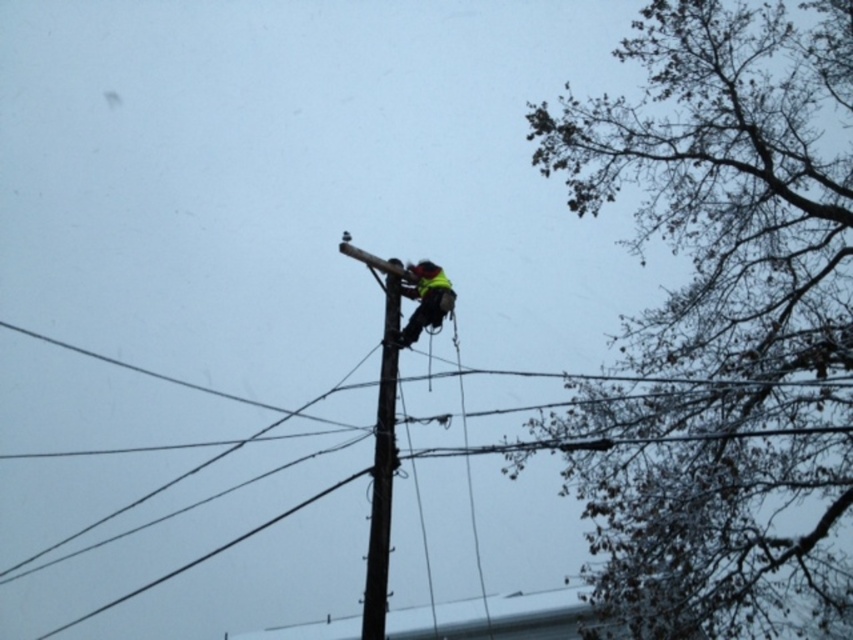
Can you confirm if brown leafy tree at upper right is wider than brown wooden telegraph pole at center?

No, brown leafy tree at upper right is not wider than brown wooden telegraph pole at center.

Which is in front, point (659, 417) or point (376, 611)?

Positioned in front is point (376, 611).

Does point (715, 326) lie behind point (386, 467)?

Yes, it is.

Locate an element on the screen. The height and width of the screenshot is (640, 853). brown leafy tree at upper right is located at coordinates (722, 323).

Does brown wooden telegraph pole at center have a lesser width compared to reflective yellow safety vest at center?

In fact, brown wooden telegraph pole at center might be wider than reflective yellow safety vest at center.

Who is more distant from viewer, [392,342] or [445,280]?

Point [445,280]

This screenshot has height=640, width=853. I want to click on brown wooden telegraph pole at center, so click(381, 444).

From the picture: Does brown leafy tree at upper right have a greater width compared to reflective yellow safety vest at center?

Incorrect, brown leafy tree at upper right's width does not surpass reflective yellow safety vest at center's.

The width and height of the screenshot is (853, 640). In order to click on brown leafy tree at upper right in this screenshot , I will do `click(722, 323)`.

Measure the distance between point (634,625) and camera.

Point (634,625) and camera are 14.06 meters apart.

Locate an element on the screen. This screenshot has width=853, height=640. brown leafy tree at upper right is located at coordinates (722, 323).